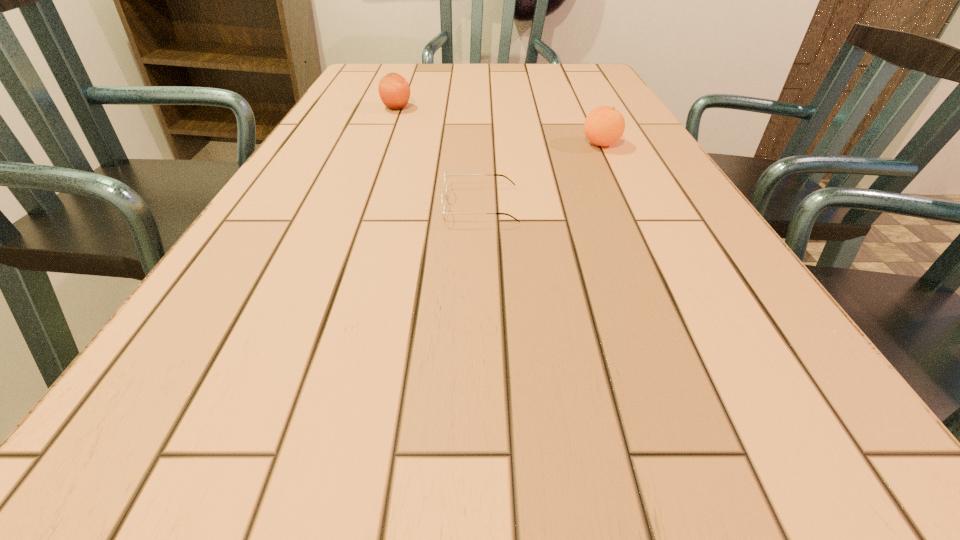
I want to click on vacant space that satisfies the following two spatial constraints: 1. on the front side of the right orange; 2. on the left side of the farthest object, so click(382, 144).